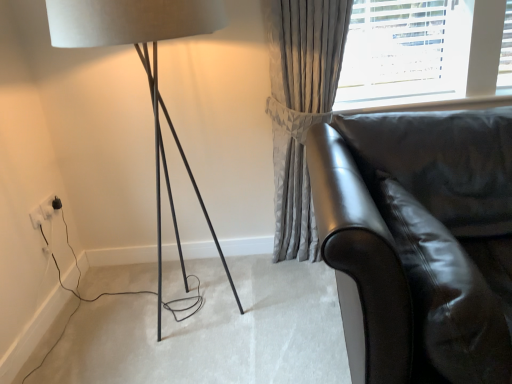
What do you see at coordinates (37, 217) in the screenshot? Image resolution: width=512 pixels, height=384 pixels. I see `white plastic electric outlet at lower left, acting as the first electric outlet starting from the front` at bounding box center [37, 217].

Image resolution: width=512 pixels, height=384 pixels. What do you see at coordinates (419, 241) in the screenshot? I see `shiny black leather couch at right` at bounding box center [419, 241].

Measure the distance between point (287, 246) and camera.

Point (287, 246) is 2.31 meters away from camera.

The image size is (512, 384). Describe the element at coordinates (144, 67) in the screenshot. I see `matte black lamp at left` at that location.

Locate an element on the screen. Image resolution: width=512 pixels, height=384 pixels. white plastic electric outlet at lower left, marked as the 2th electric outlet in a front-to-back arrangement is located at coordinates (50, 206).

You are a GUI agent. You are given a task and a screenshot of the screen. Output one action in this format:
    pyautogui.click(x=<x>, y=<y>)
    Task: Click on the white plastic electric outlet at lower left, which is counted as the 2th electric outlet, starting from the back
    
    Given the screenshot: What is the action you would take?
    pyautogui.click(x=37, y=217)

From a real-world perspective, relative to white plastic electric outlet at lower left, marked as the 2th electric outlet in a front-to-back arrangement, is satin grey curtain at upper right vertically above or below?

satin grey curtain at upper right is above white plastic electric outlet at lower left, marked as the 2th electric outlet in a front-to-back arrangement.

In the scene shown: Is satin grey curtain at upper right with white plastic electric outlet at lower left, marked as the 2th electric outlet in a front-to-back arrangement?

No, satin grey curtain at upper right is not next to white plastic electric outlet at lower left, marked as the 2th electric outlet in a front-to-back arrangement.

Can you confirm if satin grey curtain at upper right is bigger than white plastic electric outlet at lower left, marked as the 2th electric outlet in a front-to-back arrangement?

Correct, satin grey curtain at upper right is larger in size than white plastic electric outlet at lower left, marked as the 2th electric outlet in a front-to-back arrangement.

Can you confirm if satin grey curtain at upper right is taller than white plastic electric outlet at lower left, marked as the 1th electric outlet in a back-to-front arrangement?

Correct, satin grey curtain at upper right is much taller as white plastic electric outlet at lower left, marked as the 1th electric outlet in a back-to-front arrangement.

Which object is wider, satin grey curtain at upper right or matte black lamp at left?

With larger width is matte black lamp at left.

Would you say satin grey curtain at upper right is inside or outside matte black lamp at left?

satin grey curtain at upper right exists outside the volume of matte black lamp at left.

Considering the relative positions of glossy leather swivel chair at lower right and shiny black leather couch at right in the image provided, is glossy leather swivel chair at lower right to the left of shiny black leather couch at right from the viewer's perspective?

Yes, glossy leather swivel chair at lower right is to the left of shiny black leather couch at right.

What are the coordinates of `swivel chair behind the shiny black leather couch at right` in the screenshot? It's located at pyautogui.click(x=447, y=293).

Which of these two, glossy leather swivel chair at lower right or shiny black leather couch at right, stands shorter?

glossy leather swivel chair at lower right.

Is glossy leather swivel chair at lower right aimed at shiny black leather couch at right?

Yes.

Is matte black lamp at left in front of or behind shiny black leather couch at right in the image?

matte black lamp at left is behind shiny black leather couch at right.

In terms of height, does matte black lamp at left look taller or shorter compared to shiny black leather couch at right?

Clearly, matte black lamp at left is taller compared to shiny black leather couch at right.

Which object is thinner, matte black lamp at left or shiny black leather couch at right?

Thinner between the two is matte black lamp at left.

Find the location of `swivel chair above the white plastic electric outlet at lower left, which is counted as the 2th electric outlet, starting from the back (from a real-world perspective)`. swivel chair above the white plastic electric outlet at lower left, which is counted as the 2th electric outlet, starting from the back (from a real-world perspective) is located at coordinates (447, 293).

Can you see white plastic electric outlet at lower left, acting as the first electric outlet starting from the front, touching glossy leather swivel chair at lower right?

No, white plastic electric outlet at lower left, acting as the first electric outlet starting from the front, is not in contact with glossy leather swivel chair at lower right.

Consider the image. Is white plastic electric outlet at lower left, acting as the first electric outlet starting from the front, turned away from glossy leather swivel chair at lower right?

No, glossy leather swivel chair at lower right is not at the back of white plastic electric outlet at lower left, acting as the first electric outlet starting from the front.

Considering the relative sizes of white plastic electric outlet at lower left, acting as the first electric outlet starting from the front, and glossy leather swivel chair at lower right in the image provided, is white plastic electric outlet at lower left, acting as the first electric outlet starting from the front, taller than glossy leather swivel chair at lower right?

In fact, white plastic electric outlet at lower left, acting as the first electric outlet starting from the front, may be shorter than glossy leather swivel chair at lower right.

Is shiny black leather couch at right behind white plastic electric outlet at lower left, acting as the first electric outlet starting from the front?

No, shiny black leather couch at right is in front of white plastic electric outlet at lower left, acting as the first electric outlet starting from the front.

Does point (313, 188) lie behind point (35, 226)?

No, it is not.

How distant is shiny black leather couch at right from white plastic electric outlet at lower left, acting as the first electric outlet starting from the front?

They are 5.71 feet apart.

Is shiny black leather couch at right wider than matte black lamp at left?

Indeed, shiny black leather couch at right has a greater width compared to matte black lamp at left.

Does shiny black leather couch at right touch matte black lamp at left?

No, shiny black leather couch at right is not touching matte black lamp at left.

Is shiny black leather couch at right to the left or to the right of matte black lamp at left in the image?

shiny black leather couch at right is to the right of matte black lamp at left.

From a real-world perspective, is shiny black leather couch at right beneath matte black lamp at left?

Yes, from a real-world perspective, shiny black leather couch at right is under matte black lamp at left.

Which electric outlet is the 2nd one when counting from the back of the satin grey curtain at upper right? Please provide its 2D coordinates.

[(50, 206)]

The height and width of the screenshot is (384, 512). In order to click on lamp lying in front of the satin grey curtain at upper right in this screenshot , I will do `click(144, 67)`.

When comparing their distances from white plastic electric outlet at lower left, marked as the 1th electric outlet in a back-to-front arrangement, does shiny black leather couch at right or matte black lamp at left seem further?

shiny black leather couch at right is further to white plastic electric outlet at lower left, marked as the 1th electric outlet in a back-to-front arrangement.

Estimate the real-world distances between objects in this image. Which object is closer to white plastic electric outlet at lower left, acting as the first electric outlet starting from the front, white plastic electric outlet at lower left, marked as the 1th electric outlet in a back-to-front arrangement, or satin grey curtain at upper right?

white plastic electric outlet at lower left, marked as the 1th electric outlet in a back-to-front arrangement, is closer to white plastic electric outlet at lower left, acting as the first electric outlet starting from the front.

In the scene shown: Estimate the real-world distances between objects in this image. Which object is closer to white plastic electric outlet at lower left, acting as the first electric outlet starting from the front, shiny black leather couch at right or white plastic electric outlet at lower left, marked as the 1th electric outlet in a back-to-front arrangement?

white plastic electric outlet at lower left, marked as the 1th electric outlet in a back-to-front arrangement, lies closer to white plastic electric outlet at lower left, acting as the first electric outlet starting from the front, than the other object.

From the picture: When comparing their distances from matte black lamp at left, does satin grey curtain at upper right or white plastic electric outlet at lower left, marked as the 1th electric outlet in a back-to-front arrangement, seem further?

Among the two, white plastic electric outlet at lower left, marked as the 1th electric outlet in a back-to-front arrangement, is located further to matte black lamp at left.

From the image, which object appears to be farther from shiny black leather couch at right, matte black lamp at left or white plastic electric outlet at lower left, which is counted as the 2th electric outlet, starting from the back?

The object further to shiny black leather couch at right is white plastic electric outlet at lower left, which is counted as the 2th electric outlet, starting from the back.

Looking at the image, which one is located further to white plastic electric outlet at lower left, marked as the 2th electric outlet in a front-to-back arrangement, matte black lamp at left or satin grey curtain at upper right?

satin grey curtain at upper right is further to white plastic electric outlet at lower left, marked as the 2th electric outlet in a front-to-back arrangement.

Estimate the real-world distances between objects in this image. Which object is closer to satin grey curtain at upper right, shiny black leather couch at right or white plastic electric outlet at lower left, acting as the first electric outlet starting from the front?

The object closer to satin grey curtain at upper right is shiny black leather couch at right.

Looking at the image, which one is located closer to shiny black leather couch at right, white plastic electric outlet at lower left, which is counted as the 2th electric outlet, starting from the back, or satin grey curtain at upper right?

Among the two, satin grey curtain at upper right is located nearer to shiny black leather couch at right.

I want to click on swivel chair between shiny black leather couch at right and satin grey curtain at upper right along the z-axis, so pos(447,293).

The width and height of the screenshot is (512, 384). Find the location of `curtain located between white plastic electric outlet at lower left, marked as the 1th electric outlet in a back-to-front arrangement, and shiny black leather couch at right in the left-right direction`. curtain located between white plastic electric outlet at lower left, marked as the 1th electric outlet in a back-to-front arrangement, and shiny black leather couch at right in the left-right direction is located at coordinates (300, 107).

Identify the location of swivel chair between matte black lamp at left and shiny black leather couch at right. This screenshot has height=384, width=512. (447, 293).

Find the location of a particular element. The image size is (512, 384). curtain between white plastic electric outlet at lower left, acting as the first electric outlet starting from the front, and glossy leather swivel chair at lower right, in the horizontal direction is located at coordinates (300, 107).